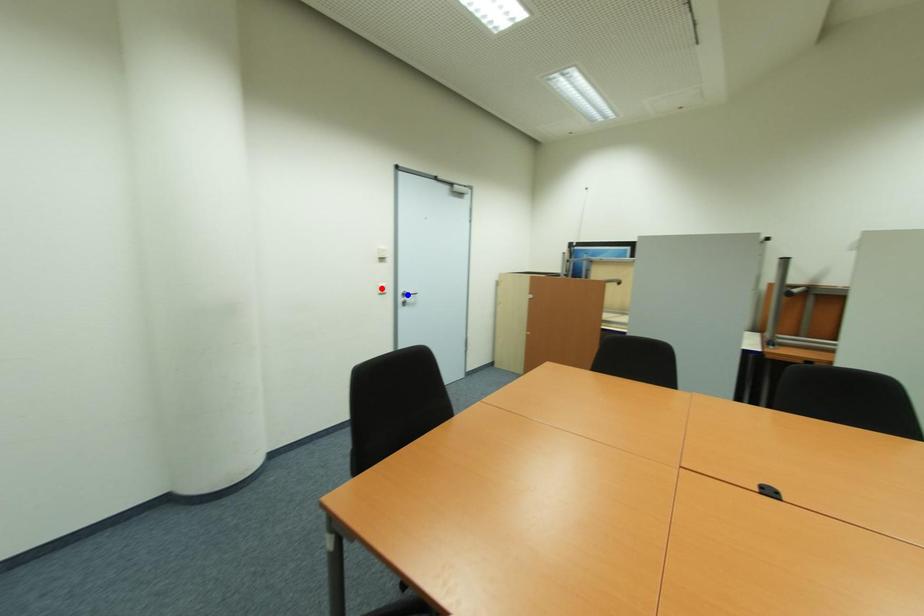
Question: In the image, two points are highlighted. Which point is nearer to the camera? Reply with the corresponding letter.

Choices:
 (A) blue point
 (B) red point

Answer: (B)